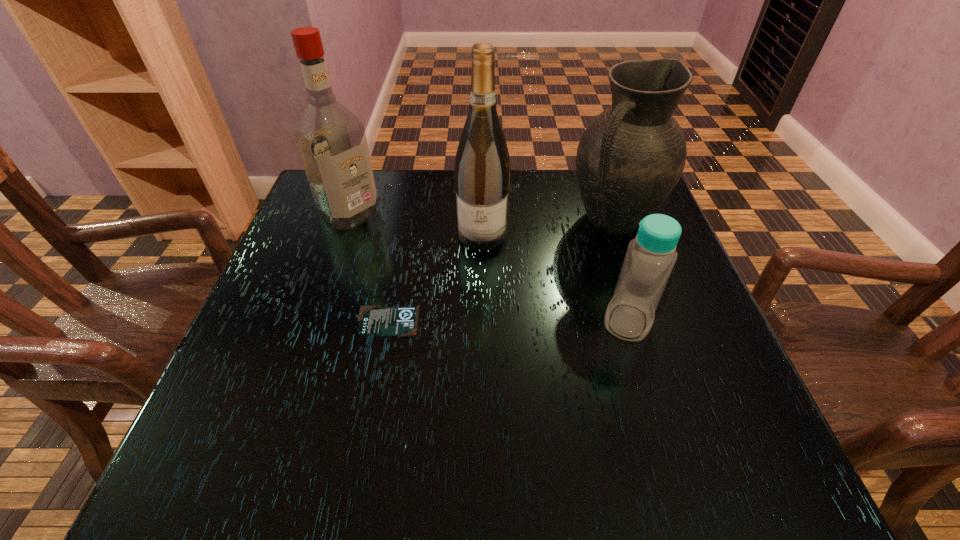
Find the location of a particular element. Image resolution: width=960 pixels, height=540 pixels. vacant position located 0.180m on the side of the pitcher with the handle is located at coordinates (543, 283).

Where is `vacant space located on the front-facing side of the leftmost object`? This screenshot has height=540, width=960. vacant space located on the front-facing side of the leftmost object is located at coordinates (380, 234).

This screenshot has height=540, width=960. I want to click on vacant area situated 0.220m on the front-facing side of the leftmost object, so click(428, 268).

The width and height of the screenshot is (960, 540). Find the location of `free space located on the front-facing side of the leftmost object`. free space located on the front-facing side of the leftmost object is located at coordinates (383, 237).

This screenshot has height=540, width=960. Find the location of `vacant space situated on the label of the wine bottle`. vacant space situated on the label of the wine bottle is located at coordinates (471, 353).

The image size is (960, 540). I want to click on blank area located 0.160m on the label of the wine bottle, so click(x=476, y=303).

Where is `free space located 0.280m on the label of the wine bottle`? This screenshot has width=960, height=540. free space located 0.280m on the label of the wine bottle is located at coordinates (471, 353).

At what (x,y) coordinates should I click in order to perform the action: click on pitcher positioned at the far edge. Please return your answer as a coordinate pair (x, y). Looking at the image, I should click on [631, 156].

You are a GUI agent. You are given a task and a screenshot of the screen. Output one action in this format:
    pyautogui.click(x=<x>, y=<y>)
    Task: Click on the liquor that is at the far edge
    This screenshot has height=540, width=960.
    Given the screenshot: What is the action you would take?
    pyautogui.click(x=331, y=140)

This screenshot has width=960, height=540. I want to click on wine bottle that is at the far edge, so click(x=482, y=173).